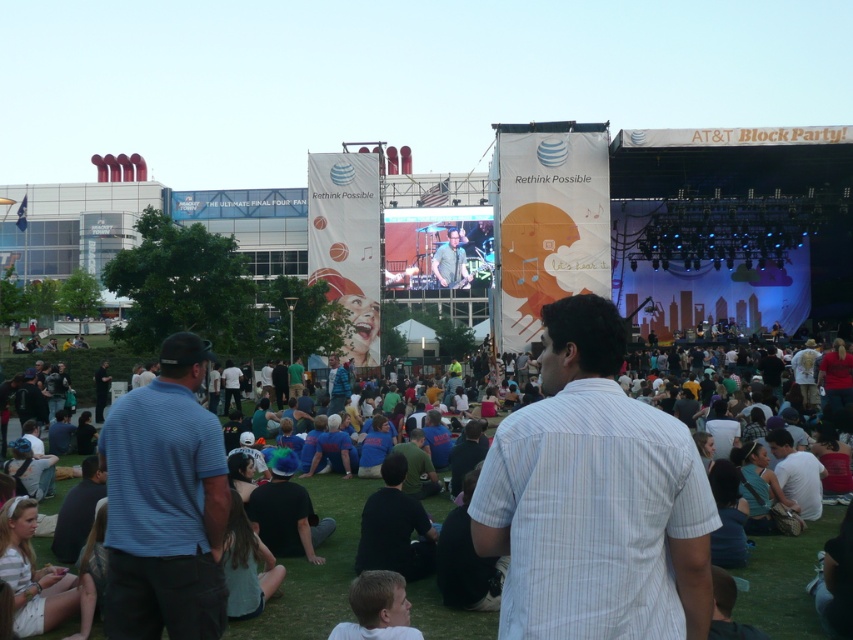
How distant is dark blue shirt at center from black fabric shirt at center?

dark blue shirt at center and black fabric shirt at center are 20.04 feet apart.

Who is more distant from viewer, (770, 563) or (253, 508)?

Point (253, 508)

I want to click on dark blue shirt at center, so click(316, 570).

Is dark blue shirt at center to the left of light blue striped shirt at lower right from the viewer's perspective?

Yes, dark blue shirt at center is to the left of light blue striped shirt at lower right.

Who is taller, dark blue shirt at center or light blue striped shirt at lower right?

dark blue shirt at center

Describe the element at coordinates (316, 570) in the screenshot. I see `dark blue shirt at center` at that location.

Where is `dark blue shirt at center`? Image resolution: width=853 pixels, height=640 pixels. dark blue shirt at center is located at coordinates (316, 570).

Does light blue striped shirt at lower right appear under green fabric shirt at center?

Correct, light blue striped shirt at lower right is located below green fabric shirt at center.

Does light blue striped shirt at lower right have a larger size compared to green fabric shirt at center?

No.

What do you see at coordinates (796, 474) in the screenshot? I see `light blue striped shirt at lower right` at bounding box center [796, 474].

The height and width of the screenshot is (640, 853). In order to click on light blue striped shirt at lower right in this screenshot , I will do (796, 474).